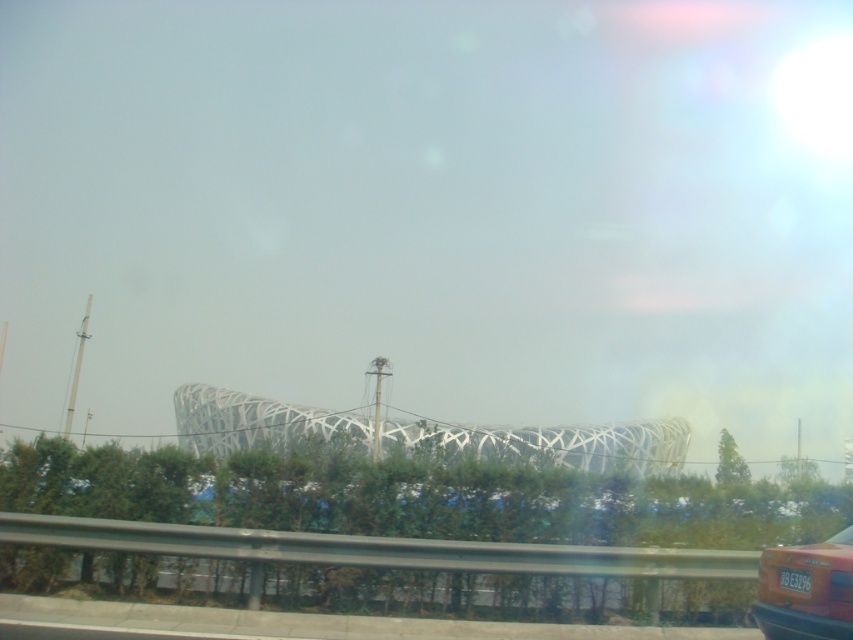
Between point (827, 637) and point (798, 573), which one is positioned behind?

Point (798, 573)

Find the location of `matte red car at lower right`. matte red car at lower right is located at coordinates (805, 589).

Is matte red car at lower right taller than transparent glass car window at lower right?

Indeed, matte red car at lower right has a greater height compared to transparent glass car window at lower right.

Is matte red car at lower right to the left of transparent glass car window at lower right from the viewer's perspective?

Indeed, matte red car at lower right is positioned on the left side of transparent glass car window at lower right.

At what (x,y) coordinates should I click in order to perform the action: click on matte red car at lower right. Please return your answer as a coordinate pair (x, y). The width and height of the screenshot is (853, 640). Looking at the image, I should click on tap(805, 589).

Who is shorter, white plastic license plate at lower right or transparent glass car window at lower right?

Standing shorter between the two is transparent glass car window at lower right.

Is point (804, 570) positioned before point (838, 538)?

Yes, it is in front of point (838, 538).

This screenshot has height=640, width=853. Find the location of `white plastic license plate at lower right`. white plastic license plate at lower right is located at coordinates (795, 579).